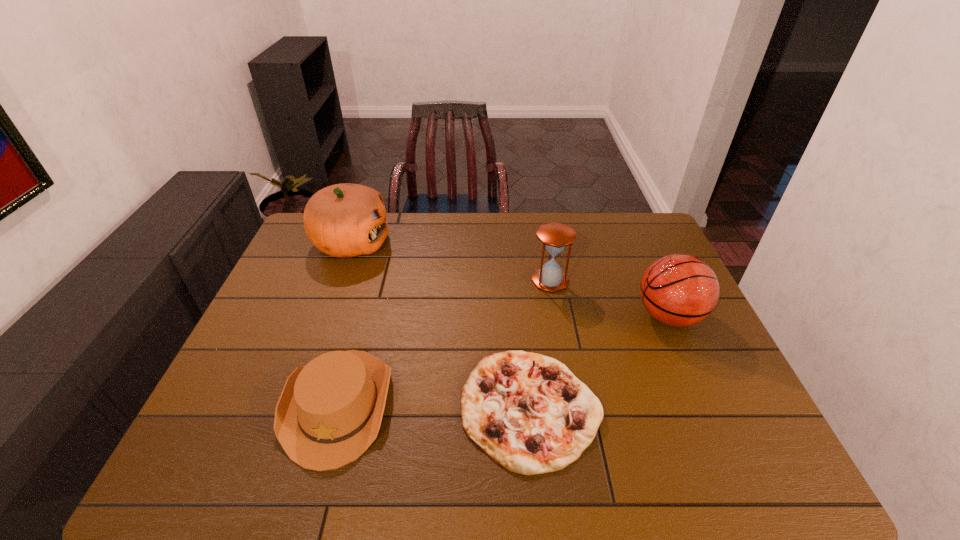
You are a GUI agent. You are given a task and a screenshot of the screen. Output one action in this format:
    pyautogui.click(x=<x>, y=<y>)
    Task: Click on the free space that satisfies the following two spatial constraints: 1. on the face of the farthest object; 2. on the right side of the shortest object
    Image resolution: width=960 pixels, height=540 pixels.
    Given the screenshot: What is the action you would take?
    pyautogui.click(x=291, y=407)